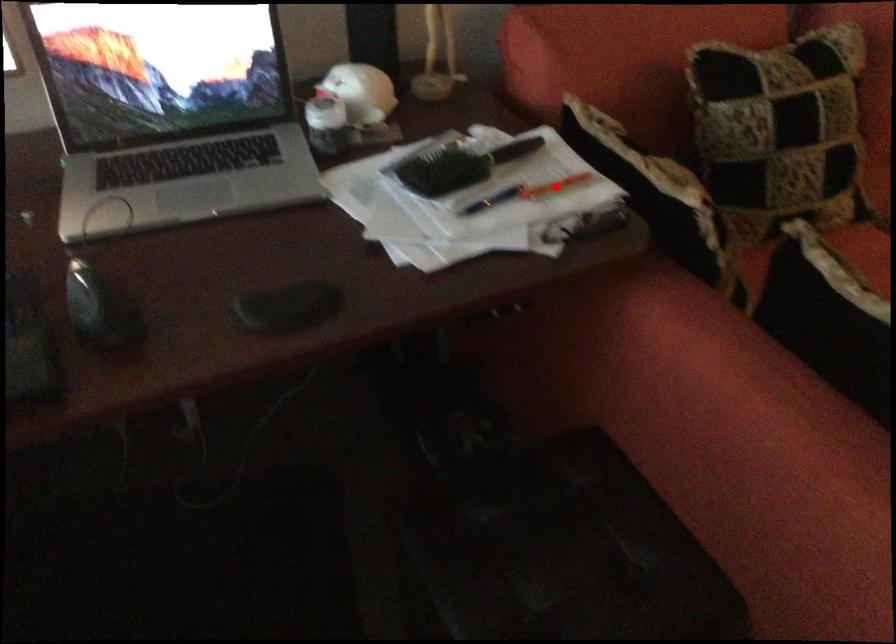
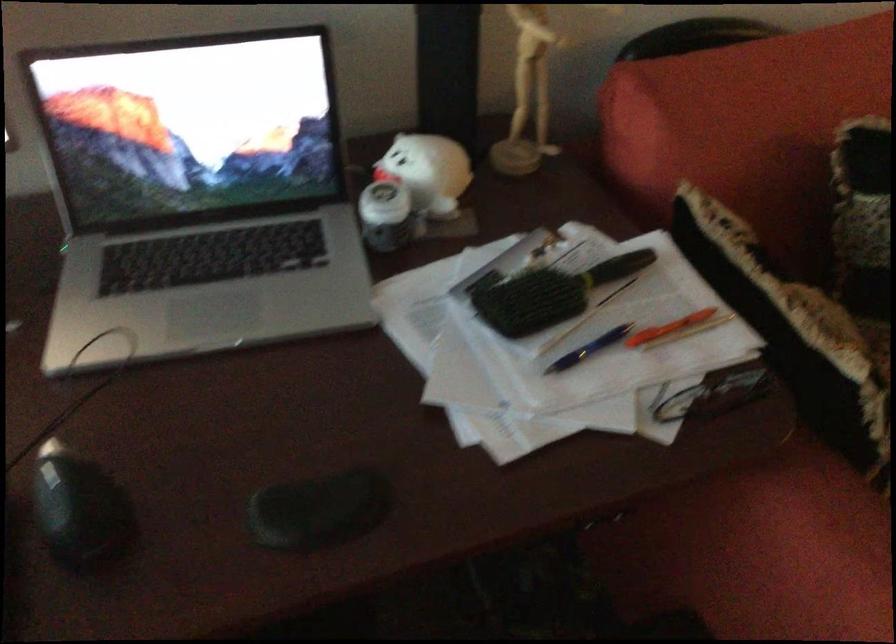
Question: I am providing you with two images of the same scene from different viewpoints. Image1 has a red point marked. In image2, the corresponding 3D location appears at what relative position? Reply with the corresponding letter.

Choices:
 (A) Closer
 (B) Farther

Answer: (A)